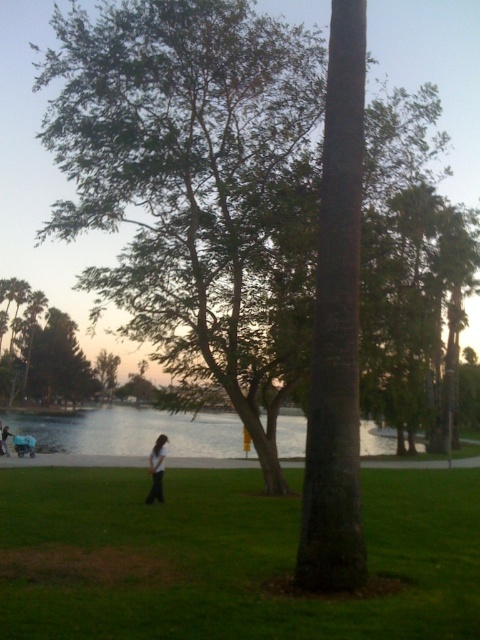
You are a photographer standing in the park scene. You notice the clear water at center and dark blue jeans at center. Which object is positioned lower in the image?

The clear water at center is positioned lower than the dark blue jeans at center in the image.

From the picture: You are standing in the park and see the green grass at center and the clear water at center. Which one is closer to you?

The green grass at center is closer to the viewer than the clear water at center.

You are standing at the point marked as point (158, 483) in the park. If you want to take a photo of the large tree with a thick trunk and dense canopy on the right side of the frame, will you be able to capture the entire tree in the photo without moving from your current position?

The point (158, 483) and camera are 50.57 feet apart from each other. Since the distance is fixed, you might need to adjust your camera angle or zoom to ensure the entire tree is captured in the photo without moving from your current position.